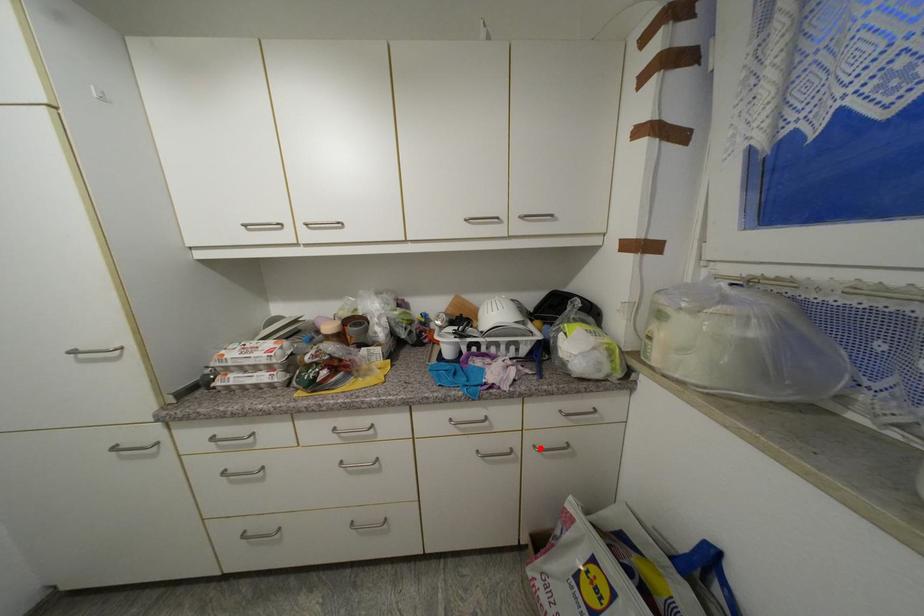
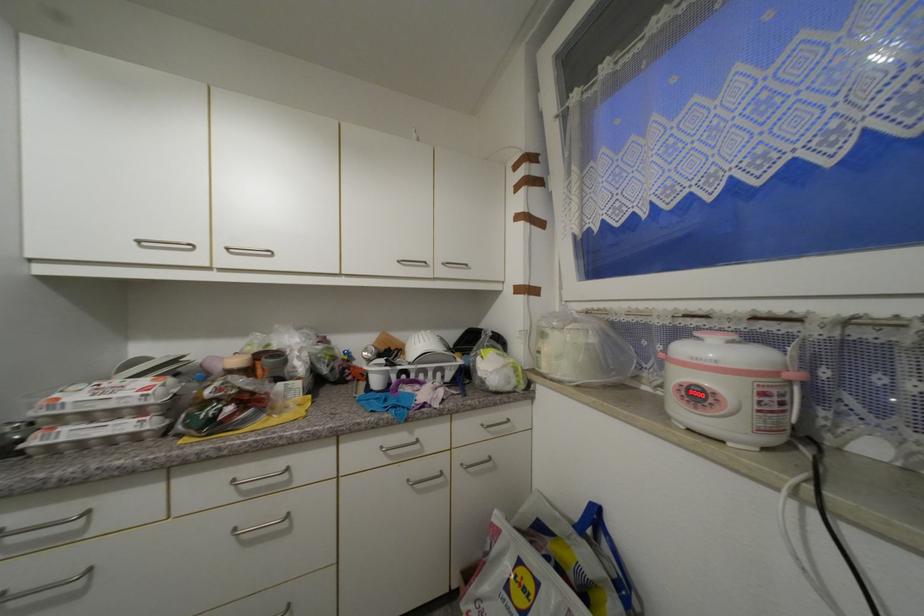
Where in the second image is the point corresponding to the highlighted location from the first image?

(468, 467)